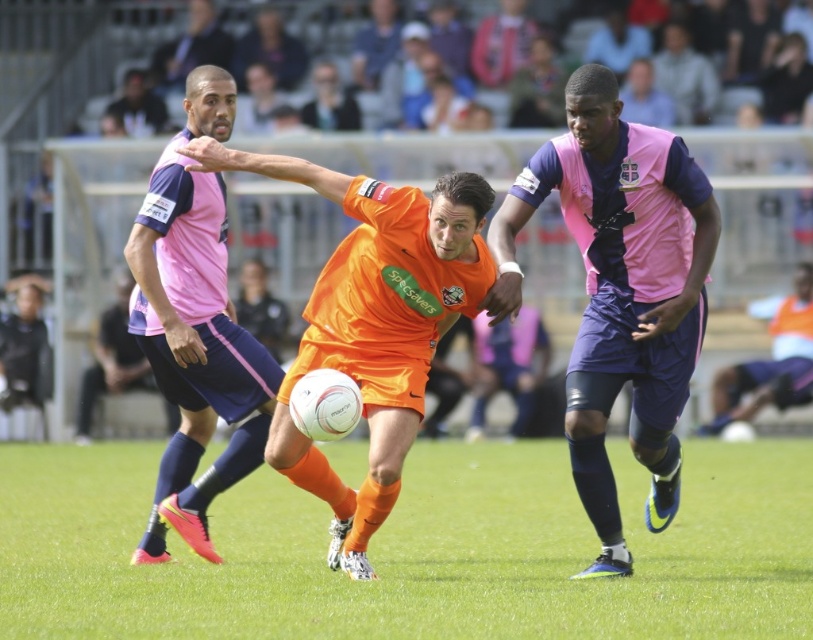
Is green grass at center to the left of pink fabric jersey at center from the viewer's perspective?

In fact, green grass at center is to the right of pink fabric jersey at center.

Between green grass at center and pink fabric jersey at center, which one has less height?

Standing shorter between the two is green grass at center.

This screenshot has width=813, height=640. Describe the element at coordinates (412, 550) in the screenshot. I see `green grass at center` at that location.

You are a GUI agent. You are given a task and a screenshot of the screen. Output one action in this format:
    pyautogui.click(x=<x>, y=<y>)
    Task: Click on the green grass at center
    Image resolution: width=813 pixels, height=640 pixels.
    Given the screenshot: What is the action you would take?
    pyautogui.click(x=412, y=550)

Does green grass at center have a greater height compared to pink matte jersey at center?

In fact, green grass at center may be shorter than pink matte jersey at center.

Is green grass at center wider than pink matte jersey at center?

Yes, green grass at center is wider than pink matte jersey at center.

Which is in front, point (801, 586) or point (611, 323)?

Point (801, 586) is in front.

Locate an element on the screen. green grass at center is located at coordinates (412, 550).

Based on the photo, is pink matte jersey at center smaller than pink fabric jersey at center?

No, pink matte jersey at center is not smaller than pink fabric jersey at center.

Does point (529, 212) come behind point (194, 349)?

No, it is in front of (194, 349).

I want to click on pink matte jersey at center, so click(620, 291).